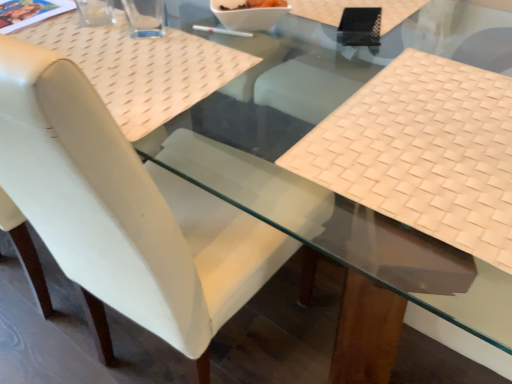
Question: From a real-world perspective, is white plastic chopstick at center physically above white glossy bowl at center?

Choices:
 (A) no
 (B) yes

Answer: (A)

Question: Is white plastic chopstick at center thinner than white glossy bowl at center?

Choices:
 (A) yes
 (B) no

Answer: (A)

Question: Can you confirm if white plastic chopstick at center is shorter than white glossy bowl at center?

Choices:
 (A) no
 (B) yes

Answer: (B)

Question: Is the position of white plastic chopstick at center less distant than that of white glossy bowl at center?

Choices:
 (A) no
 (B) yes

Answer: (A)

Question: Is white glossy bowl at center located within white plastic chopstick at center?

Choices:
 (A) no
 (B) yes

Answer: (A)

Question: Considering the relative sizes of white plastic chopstick at center and white glossy bowl at center in the image provided, is white plastic chopstick at center taller than white glossy bowl at center?

Choices:
 (A) no
 (B) yes

Answer: (A)

Question: Is transparent glass cup at upper left, the second clear positioned from the right, closer to the viewer compared to white plastic chopstick at center?

Choices:
 (A) yes
 (B) no

Answer: (A)

Question: Considering the relative sizes of transparent glass cup at upper left, the second clear positioned from the right, and white plastic chopstick at center in the image provided, is transparent glass cup at upper left, the second clear positioned from the right, shorter than white plastic chopstick at center?

Choices:
 (A) yes
 (B) no

Answer: (B)

Question: Is transparent glass cup at upper left, the second clear positioned from the right, far away from white plastic chopstick at center?

Choices:
 (A) no
 (B) yes

Answer: (A)

Question: Does transparent glass cup at upper left, the second clear positioned from the right, have a smaller size compared to white plastic chopstick at center?

Choices:
 (A) no
 (B) yes

Answer: (A)

Question: Are transparent glass cup at upper left, the second clear positioned from the right, and white plastic chopstick at center making contact?

Choices:
 (A) yes
 (B) no

Answer: (B)

Question: From a real-world perspective, is transparent glass cup at upper left, the second clear positioned from the right, positioned over white plastic chopstick at center based on gravity?

Choices:
 (A) no
 (B) yes

Answer: (B)

Question: Can you confirm if beige woven mat at right is taller than transparent glass cup at upper left, marked as the 1th clear in a left-to-right arrangement?

Choices:
 (A) no
 (B) yes

Answer: (A)